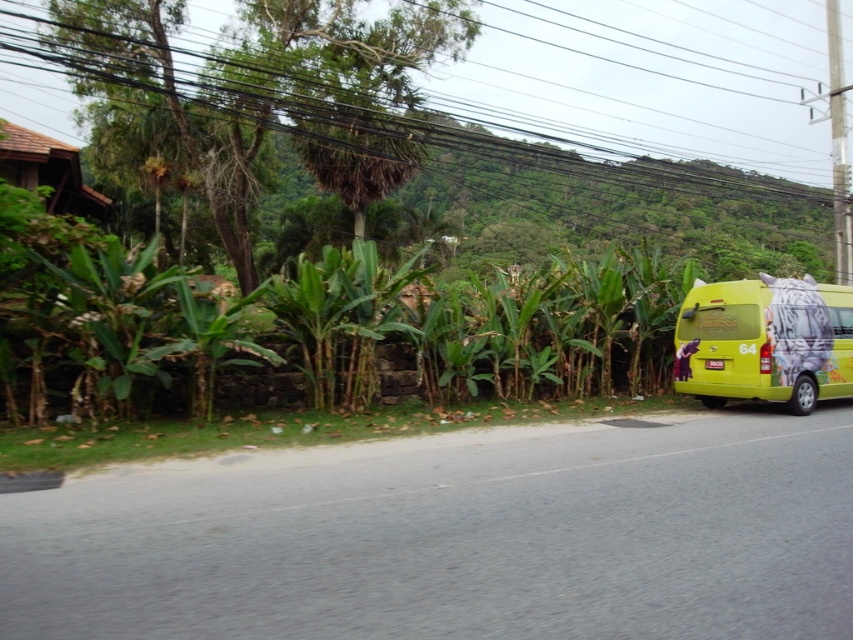
Question: Does green leafy plants at center have a smaller size compared to black wire at upper center?

Choices:
 (A) yes
 (B) no

Answer: (A)

Question: Which of the following is the farthest from the observer?

Choices:
 (A) (287, 320)
 (B) (787, 346)

Answer: (B)

Question: Among these points, which one is nearest to the camera?

Choices:
 (A) [x=343, y=301]
 (B) [x=828, y=301]
 (C) [x=502, y=49]

Answer: (A)

Question: Which point is closer to the camera?

Choices:
 (A) (376, 284)
 (B) (825, 333)

Answer: (A)

Question: Does black wire at upper center have a greater width compared to yellow matte van at right?

Choices:
 (A) yes
 (B) no

Answer: (A)

Question: Is green leafy plants at center to the right of yellow matte van at right from the viewer's perspective?

Choices:
 (A) no
 (B) yes

Answer: (A)